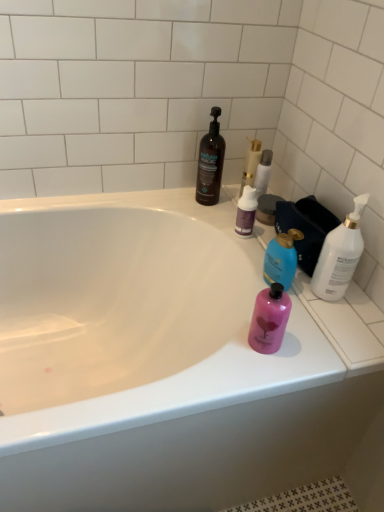
At what (x,y) coordinates should I click in order to perform the action: click on free space in front of dark brown plastic bottle at upper center, arranged as the 5th bottle when viewed from the right. Please return your answer as a coordinate pair (x, y). Looking at the image, I should click on (208, 223).